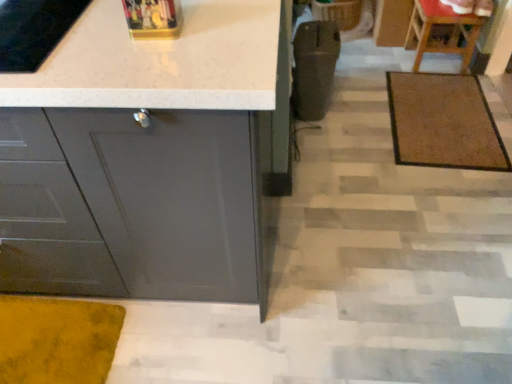
Question: In the image, is wooden chair at upper right on the left side or the right side of brown textured mat at center right?

Choices:
 (A) right
 (B) left

Answer: (A)

Question: From a real-world perspective, relative to brown textured mat at center right, is wooden chair at upper right vertically above or below?

Choices:
 (A) above
 (B) below

Answer: (A)

Question: Which is farther from the brown textured mat at center right?

Choices:
 (A) wooden chair at upper right
 (B) matte gray cabinet at lower left

Answer: (B)

Question: Which is farther from the brown textured mat at center right?

Choices:
 (A) wooden chair at upper right
 (B) matte gray cabinet at lower left

Answer: (B)